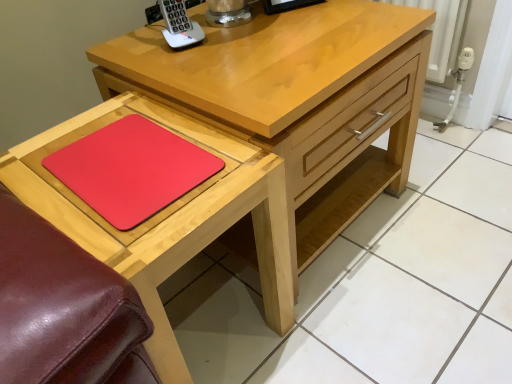
Identify the location of vacant space in front of white plastic phone at upper center. (197, 69).